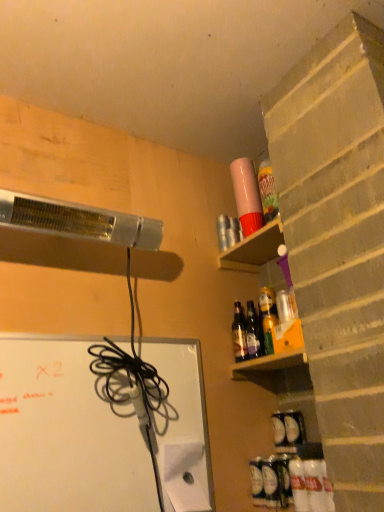
Question: Does purple plastic cup at upper right have a larger size compared to shiny brown glass bottles at upper right, placed as the 1th bottle when sorted from back to front?

Choices:
 (A) yes
 (B) no

Answer: (A)

Question: Does purple plastic cup at upper right touch shiny brown glass bottles at upper right, the second bottle ordered from the bottom?

Choices:
 (A) no
 (B) yes

Answer: (A)

Question: Is the depth of purple plastic cup at upper right greater than that of shiny brown glass bottles at upper right, positioned as the second bottle in top-to-bottom order?

Choices:
 (A) yes
 (B) no

Answer: (B)

Question: Does purple plastic cup at upper right have a lesser height compared to shiny brown glass bottles at upper right, the second bottle ordered from the bottom?

Choices:
 (A) yes
 (B) no

Answer: (A)

Question: From a real-world perspective, is purple plastic cup at upper right located higher than shiny brown glass bottles at upper right, placed as the 1th bottle when sorted from back to front?

Choices:
 (A) no
 (B) yes

Answer: (B)

Question: Looking at the image, does shiny brown glass bottles at upper right, positioned as the second bottle in top-to-bottom order, seem bigger or smaller compared to translucent glass bottles at shelf right, arranged as the 1th bottle when viewed from the top?

Choices:
 (A) small
 (B) big

Answer: (B)

Question: Looking at their shapes, would you say shiny brown glass bottles at upper right, the second bottle ordered from the bottom, is wider or thinner than translucent glass bottles at shelf right, arranged as the 1th bottle when viewed from the top?

Choices:
 (A) thin
 (B) wide

Answer: (B)

Question: Is shiny brown glass bottles at upper right, positioned as the second bottle in top-to-bottom order, taller or shorter than translucent glass bottles at shelf right, the second bottle positioned from the front?

Choices:
 (A) short
 (B) tall

Answer: (B)

Question: Considering the positions of point (238, 350) and point (251, 347), is point (238, 350) closer or farther from the camera than point (251, 347)?

Choices:
 (A) farther
 (B) closer

Answer: (A)

Question: Is point (248, 254) closer or farther from the camera than point (182, 384)?

Choices:
 (A) closer
 (B) farther

Answer: (B)

Question: From the image's perspective, relative to white matte bulletin board at lower left, is purple plastic cup at upper right above or below?

Choices:
 (A) above
 (B) below

Answer: (A)

Question: Is purple plastic cup at upper right wider or thinner than white matte bulletin board at lower left?

Choices:
 (A) thin
 (B) wide

Answer: (B)

Question: From their relative heights in the image, would you say purple plastic cup at upper right is taller or shorter than white matte bulletin board at lower left?

Choices:
 (A) short
 (B) tall

Answer: (A)

Question: Considering the positions of purple plastic cup at upper right and translucent plastic bottle at lower right, the third bottle when ordered from top to bottom, in the image, is purple plastic cup at upper right wider or thinner than translucent plastic bottle at lower right, the third bottle when ordered from top to bottom,?

Choices:
 (A) wide
 (B) thin

Answer: (A)

Question: From the image's perspective, relative to translucent plastic bottle at lower right, the 3th bottle in the back-to-front sequence, is purple plastic cup at upper right above or below?

Choices:
 (A) below
 (B) above

Answer: (B)